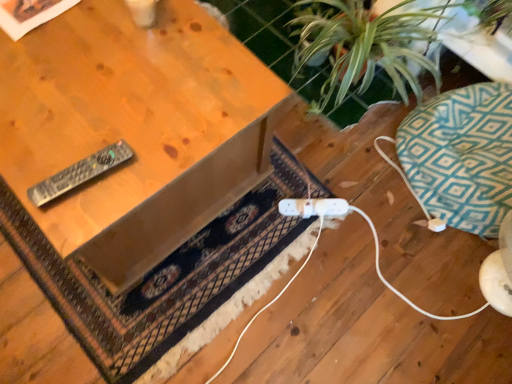
Question: Considering the relative sizes of wooden table at upper left and teal geometric cushion at right in the image provided, is wooden table at upper left shorter than teal geometric cushion at right?

Choices:
 (A) no
 (B) yes

Answer: (A)

Question: Considering the relative sizes of wooden table at upper left and teal geometric cushion at right in the image provided, is wooden table at upper left bigger than teal geometric cushion at right?

Choices:
 (A) no
 (B) yes

Answer: (B)

Question: Does wooden table at upper left turn towards teal geometric cushion at right?

Choices:
 (A) yes
 (B) no

Answer: (B)

Question: From the image's perspective, does wooden table at upper left appear lower than teal geometric cushion at right?

Choices:
 (A) yes
 (B) no

Answer: (B)

Question: Considering the relative positions of wooden table at upper left and teal geometric cushion at right in the image provided, is wooden table at upper left in front of teal geometric cushion at right?

Choices:
 (A) no
 (B) yes

Answer: (B)

Question: Is wooden table at upper left wider than teal geometric cushion at right?

Choices:
 (A) no
 (B) yes

Answer: (B)

Question: From the image's perspective, is white plastic plug at lower center located beneath teal geometric cushion at right?

Choices:
 (A) yes
 (B) no

Answer: (A)

Question: Can you confirm if white plastic plug at lower center is wider than teal geometric cushion at right?

Choices:
 (A) yes
 (B) no

Answer: (B)

Question: Is white plastic plug at lower center further to the viewer compared to teal geometric cushion at right?

Choices:
 (A) no
 (B) yes

Answer: (B)

Question: Is white plastic plug at lower center positioned with its back to teal geometric cushion at right?

Choices:
 (A) yes
 (B) no

Answer: (A)

Question: From the image's perspective, is white plastic plug at lower center on teal geometric cushion at right?

Choices:
 (A) yes
 (B) no

Answer: (B)

Question: Is white plastic plug at lower center next to teal geometric cushion at right and touching it?

Choices:
 (A) no
 (B) yes

Answer: (A)

Question: Is teal geometric cushion at right taller than black plastic remote at left?

Choices:
 (A) yes
 (B) no

Answer: (A)